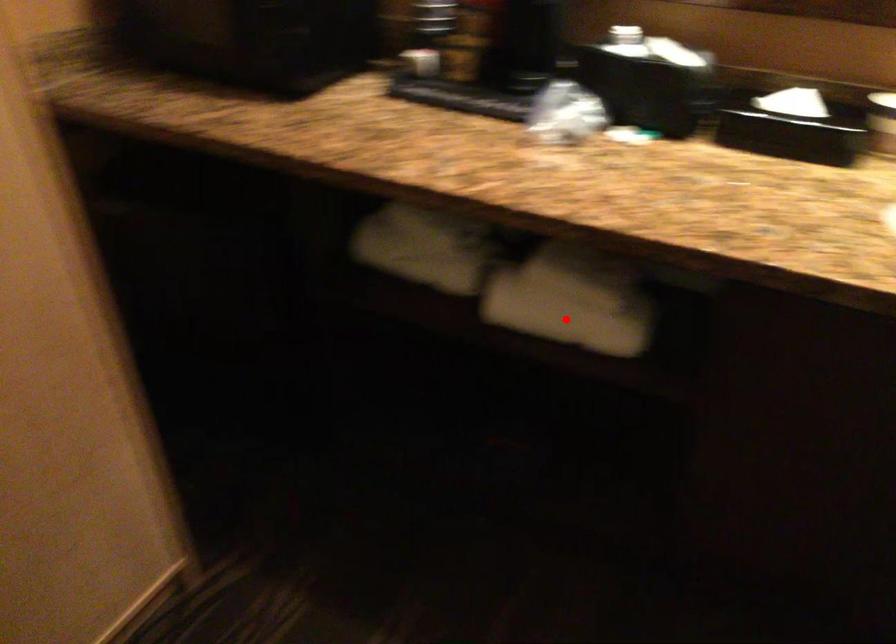
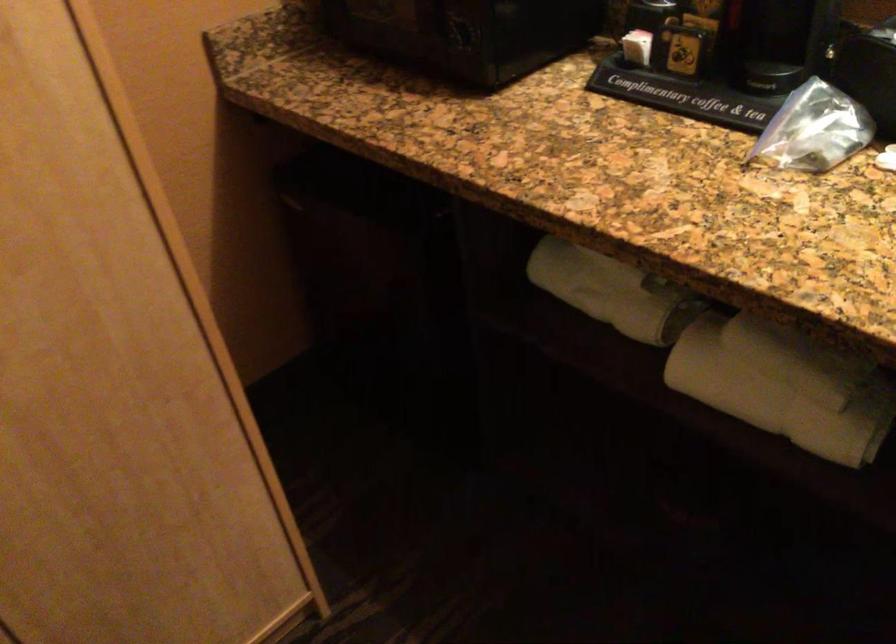
In the second image, find the point that corresponds to the highlighted location in the first image.

(770, 402)